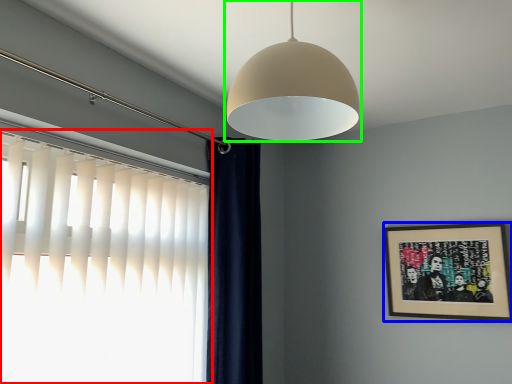
Question: Considering the real-world distances, which object is closest to window (highlighted by a red box)? picture frame (highlighted by a blue box) or lamp (highlighted by a green box).

Choices:
 (A) picture frame
 (B) lamp

Answer: (B)